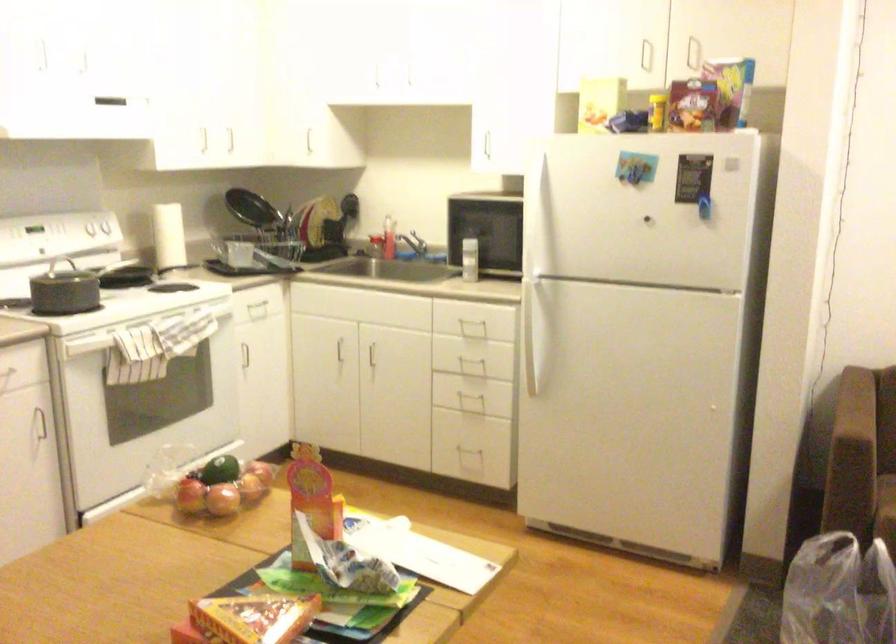
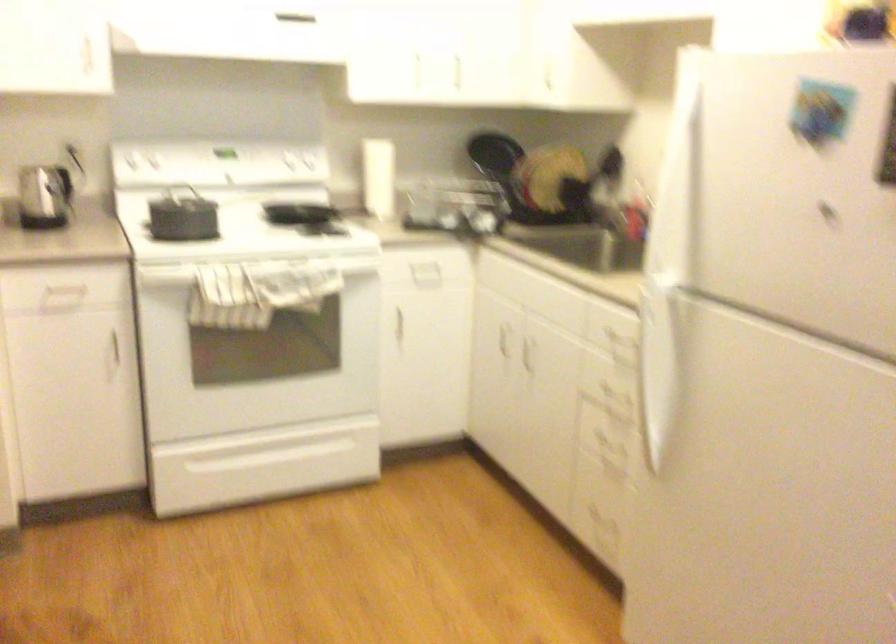
The point at (277, 368) is marked in the first image. Where is the corresponding point in the second image?

(425, 342)